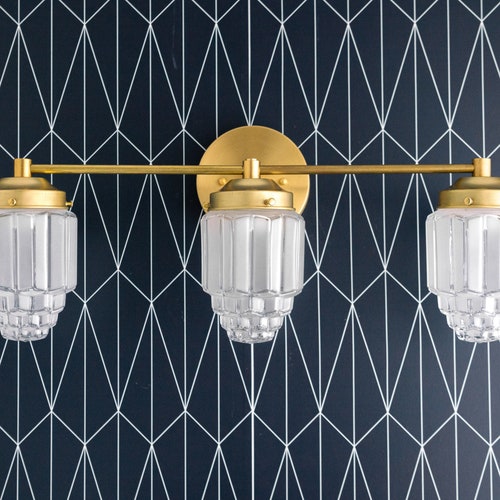
Locate an element on the screen. This screenshot has width=500, height=500. light fitting is located at coordinates (259, 140).